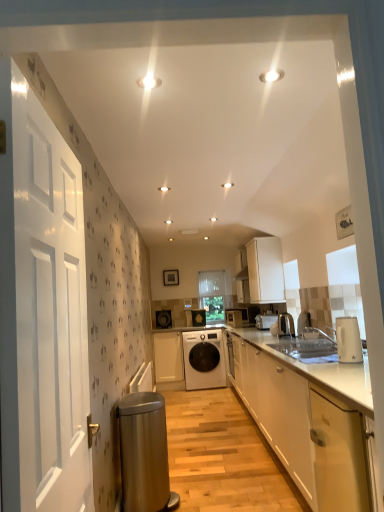
Question: Is transparent plastic window screen at center facing away from metallic silver kettle at right, marked as the 5th appliance in a back-to-front arrangement?

Choices:
 (A) yes
 (B) no

Answer: (B)

Question: Are transparent plastic window screen at center and metallic silver kettle at right, which is the 2th appliance from front to back, far apart?

Choices:
 (A) yes
 (B) no

Answer: (A)

Question: Would you say metallic silver kettle at right, marked as the 5th appliance in a back-to-front arrangement, is part of transparent plastic window screen at center's contents?

Choices:
 (A) no
 (B) yes

Answer: (A)

Question: Does transparent plastic window screen at center have a smaller size compared to metallic silver kettle at right, marked as the 5th appliance in a back-to-front arrangement?

Choices:
 (A) no
 (B) yes

Answer: (A)

Question: Is transparent plastic window screen at center further to the viewer compared to metallic silver kettle at right, which is the 2th appliance from front to back?

Choices:
 (A) no
 (B) yes

Answer: (B)

Question: From a real-world perspective, is transparent plastic window screen at center under metallic silver kettle at right, marked as the 5th appliance in a back-to-front arrangement?

Choices:
 (A) yes
 (B) no

Answer: (B)

Question: Does white glossy cabinet at lower right, acting as the 2th cabinetry starting from the front, have a greater width compared to white glossy door at left?

Choices:
 (A) yes
 (B) no

Answer: (A)

Question: Considering the relative sizes of white glossy cabinet at lower right, acting as the 2th cabinetry starting from the front, and white glossy door at left in the image provided, is white glossy cabinet at lower right, acting as the 2th cabinetry starting from the front, taller than white glossy door at left?

Choices:
 (A) no
 (B) yes

Answer: (A)

Question: Are white glossy cabinet at lower right, arranged as the 2th cabinetry when viewed from the right, and white glossy door at left far apart?

Choices:
 (A) no
 (B) yes

Answer: (B)

Question: Considering the relative sizes of white glossy cabinet at lower right, the 3th cabinetry positioned from the left, and white glossy door at left in the image provided, is white glossy cabinet at lower right, the 3th cabinetry positioned from the left, shorter than white glossy door at left?

Choices:
 (A) yes
 (B) no

Answer: (A)

Question: From the image's perspective, is white glossy cabinet at lower right, arranged as the 2th cabinetry when viewed from the right, over white glossy door at left?

Choices:
 (A) no
 (B) yes

Answer: (A)

Question: Is white glossy cabinet at lower right, arranged as the third cabinetry when viewed from the back, not within white glossy door at left?

Choices:
 (A) yes
 (B) no

Answer: (A)

Question: Does white matte cabinet at upper center, the 1th cabinetry when ordered from right to left, appear on the right side of white glossy toaster at center, the 3th appliance from the front?

Choices:
 (A) no
 (B) yes

Answer: (A)